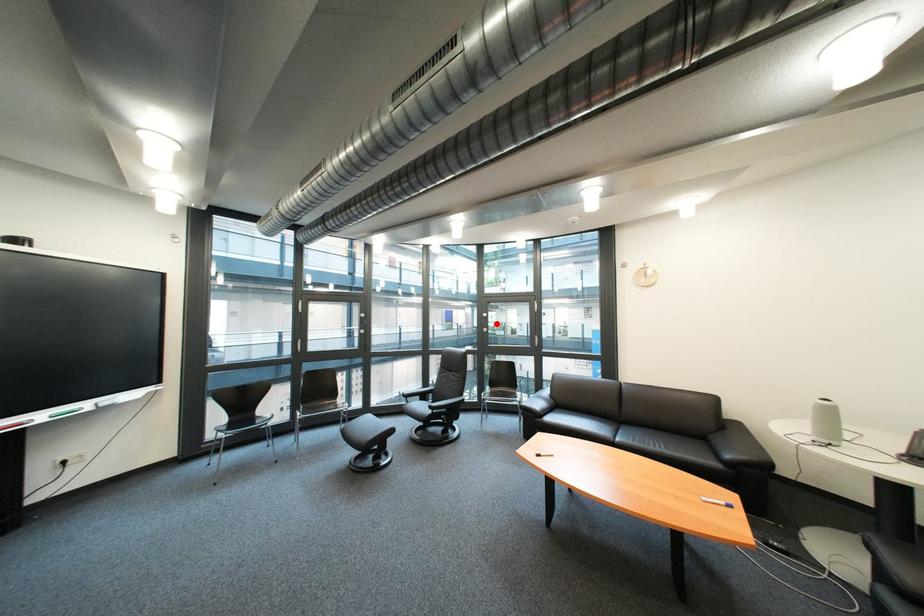
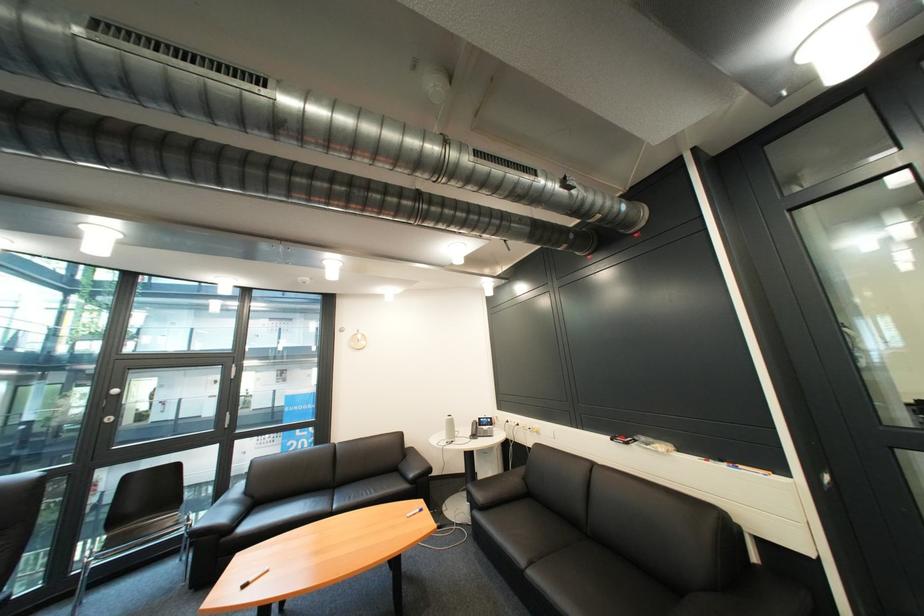
Where in the second image is the point corresponding to the highlighted location from the first image?

(118, 408)